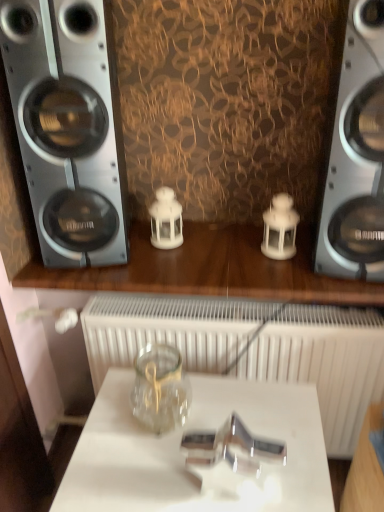
Question: Is silver metallic speaker at left, placed as the 1th home appliance when sorted from left to right, taller or shorter than metallic silver speaker at right, which is the first home appliance from right to left?

Choices:
 (A) short
 (B) tall

Answer: (B)

Question: In terms of width, does silver metallic speaker at left, placed as the 1th home appliance when sorted from left to right, look wider or thinner when compared to metallic silver speaker at right, placed as the second home appliance when sorted from left to right?

Choices:
 (A) thin
 (B) wide

Answer: (A)

Question: Which object is positioned closest to the metallic silver speaker at right, which is the first home appliance from right to left?

Choices:
 (A) silver metallic speaker at left, placed as the 1th home appliance when sorted from left to right
 (B) transparent glass jar at center
 (C) transparent glass jar at center
 (D) white matte radiator at center

Answer: (D)

Question: Which is nearer to the white matte radiator at center?

Choices:
 (A) transparent glass jar at center
 (B) transparent glass jar at center
 (C) metallic silver speaker at right, which is the first home appliance from right to left
 (D) silver metallic speaker at left, placed as the 1th home appliance when sorted from left to right

Answer: (A)